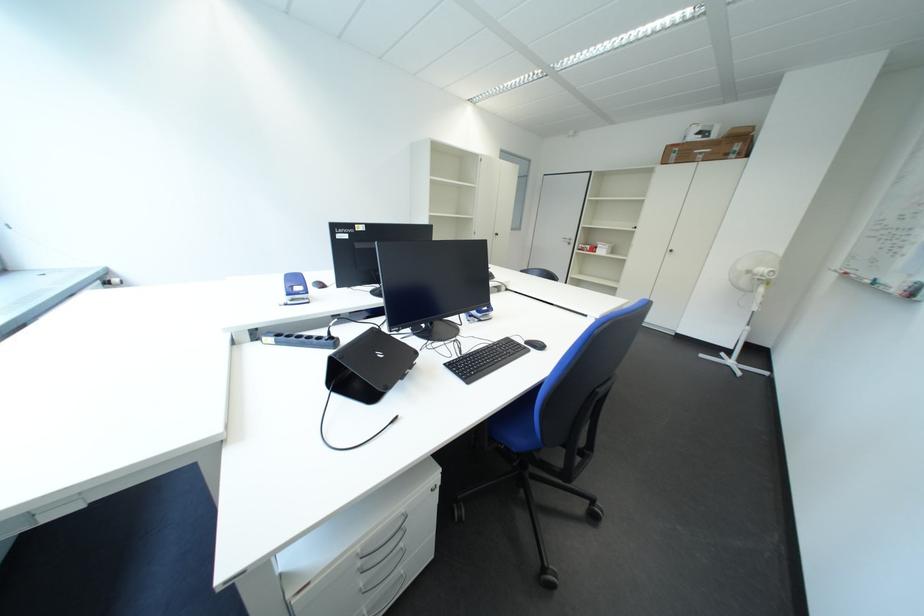
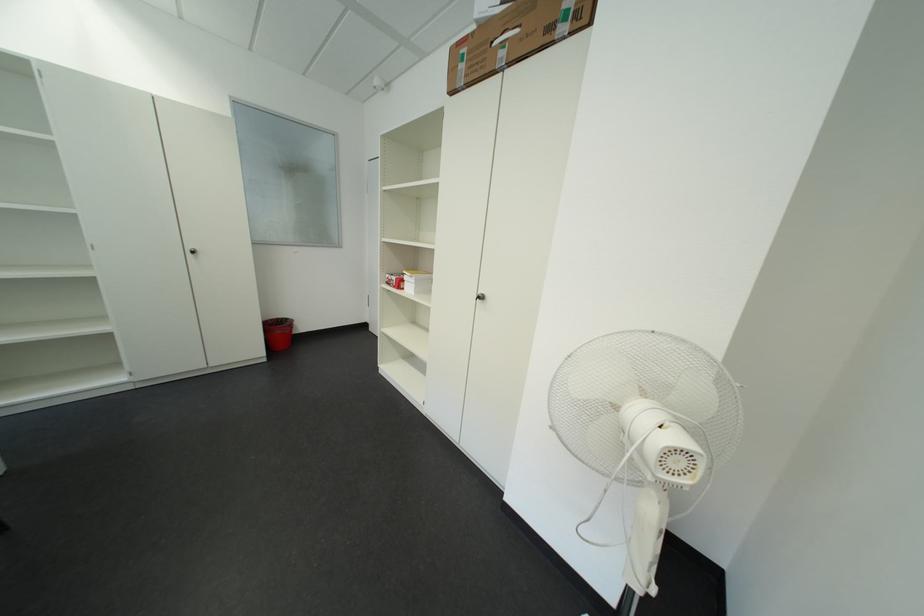
In the second image, find the point that corresponds to pixel 605 252 in the first image.

(411, 286)